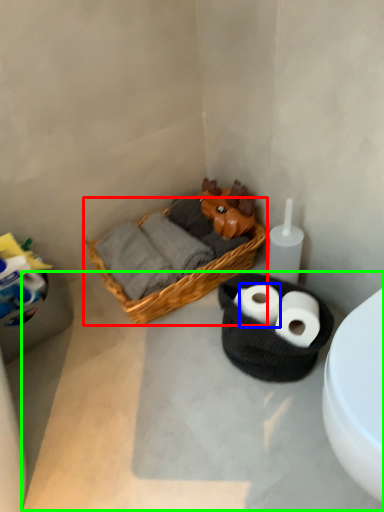
Question: Estimate the real-world distances between objects in this image. Which object is closer to picnic basket (highlighted by a red box), toilet paper (highlighted by a blue box) or concrete (highlighted by a green box)?

Choices:
 (A) toilet paper
 (B) concrete

Answer: (B)